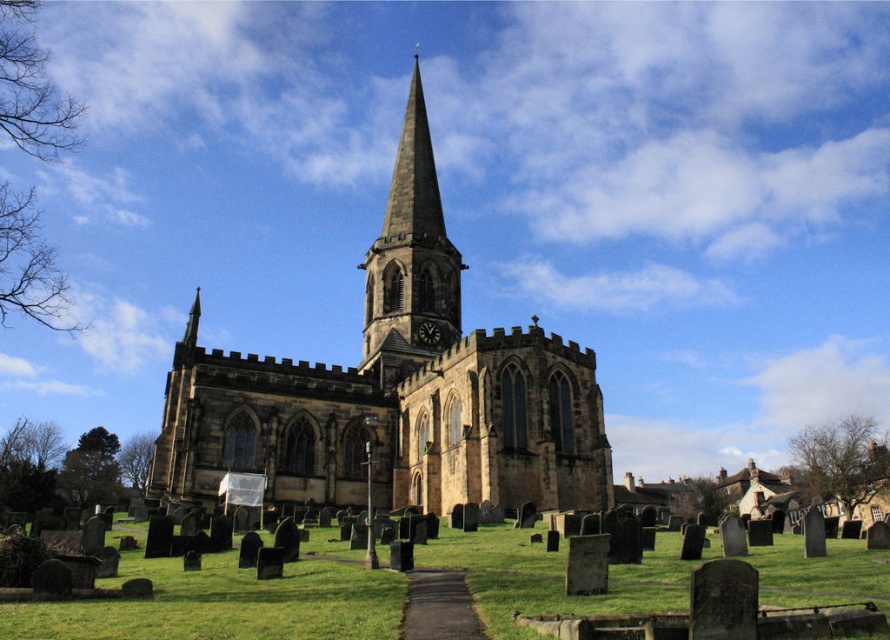
Question: Based on their relative distances, which object is nearer to the green grass at lower center?

Choices:
 (A) smooth stone spire at center
 (B) brown stone church at center

Answer: (B)

Question: Estimate the real-world distances between objects in this image. Which object is farther from the brown stone church at center?

Choices:
 (A) smooth stone spire at center
 (B) green grass at lower center

Answer: (B)

Question: Can you confirm if brown stone church at center is positioned to the right of smooth stone spire at center?

Choices:
 (A) no
 (B) yes

Answer: (B)

Question: Can you confirm if brown stone church at center is smaller than green grass at lower center?

Choices:
 (A) no
 (B) yes

Answer: (A)

Question: Which of these objects is positioned farthest from the brown stone church at center?

Choices:
 (A) smooth stone spire at center
 (B) green grass at lower center

Answer: (B)

Question: Does green grass at lower center appear on the left side of smooth stone spire at center?

Choices:
 (A) yes
 (B) no

Answer: (B)